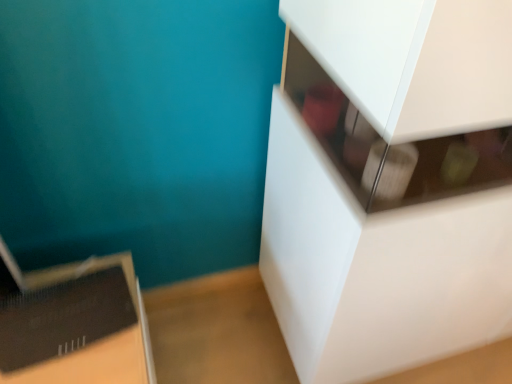
The height and width of the screenshot is (384, 512). Describe the element at coordinates (389, 184) in the screenshot. I see `white glossy cabinet at upper right` at that location.

At what (x,y) coordinates should I click in order to perform the action: click on white glossy cabinet at upper right. Please return your answer as a coordinate pair (x, y). Image resolution: width=512 pixels, height=384 pixels. Looking at the image, I should click on (389, 184).

From the picture: Measure the distance between point [332,85] and camera.

Point [332,85] is 35.00 inches away from camera.

What do you see at coordinates (78, 327) in the screenshot? The image size is (512, 384). I see `black cardboard box at lower left` at bounding box center [78, 327].

Image resolution: width=512 pixels, height=384 pixels. I want to click on black cardboard box at lower left, so click(78, 327).

Find the location of `white glossy cabinet at upper right`. white glossy cabinet at upper right is located at coordinates (389, 184).

Considering the relative positions of white glossy cabinet at upper right and black cardboard box at lower left in the image provided, is white glossy cabinet at upper right to the left of black cardboard box at lower left from the viewer's perspective?

No.

Is white glossy cabinet at upper right behind black cardboard box at lower left?

No, white glossy cabinet at upper right is closer to the camera.

Which point is more distant from viewer, (458, 244) or (1, 330)?

The point (458, 244) is farther from the camera.

From the image's perspective, is white glossy cabinet at upper right on top of black cardboard box at lower left?

Yes, from the image's perspective, white glossy cabinet at upper right is above black cardboard box at lower left.

From a real-world perspective, which object stands above the other?

white glossy cabinet at upper right, from a real-world perspective.

Which of these two, white glossy cabinet at upper right or black cardboard box at lower left, is thinner?

black cardboard box at lower left is thinner.

Is white glossy cabinet at upper right taller or shorter than black cardboard box at lower left?

In the image, white glossy cabinet at upper right appears to be taller than black cardboard box at lower left.

Who is bigger, white glossy cabinet at upper right or black cardboard box at lower left?

white glossy cabinet at upper right is bigger.

Do you think white glossy cabinet at upper right is within black cardboard box at lower left, or outside of it?

white glossy cabinet at upper right is not enclosed by black cardboard box at lower left.

Would you consider white glossy cabinet at upper right to be distant from black cardboard box at lower left?

white glossy cabinet at upper right is actually quite close to black cardboard box at lower left.

Is white glossy cabinet at upper right positioned with its back to black cardboard box at lower left?

white glossy cabinet at upper right is not turned away from black cardboard box at lower left.

How distant is white glossy cabinet at upper right from black cardboard box at lower left?

20.43 inches.

Locate an element on the screen. Image resolution: width=512 pixels, height=384 pixels. furniture above the black cardboard box at lower left (from the image's perspective) is located at coordinates (389, 184).

Does black cardboard box at lower left appear on the right side of white glossy cabinet at upper right?

Incorrect, black cardboard box at lower left is not on the right side of white glossy cabinet at upper right.

Relative to white glossy cabinet at upper right, is black cardboard box at lower left in front or behind?

Visually, black cardboard box at lower left is located behind white glossy cabinet at upper right.

Does point (23, 305) appear closer or farther from the camera than point (467, 45)?

Point (23, 305) is positioned farther from the camera compared to point (467, 45).

From the image's perspective, does black cardboard box at lower left appear higher than white glossy cabinet at upper right?

No, from the image's perspective, black cardboard box at lower left is not on top of white glossy cabinet at upper right.

From a real-world perspective, is black cardboard box at lower left over white glossy cabinet at upper right?

Actually, black cardboard box at lower left is physically below white glossy cabinet at upper right in the real world.

Between black cardboard box at lower left and white glossy cabinet at upper right, which one has larger width?

With larger width is white glossy cabinet at upper right.

Does black cardboard box at lower left have a lesser height compared to white glossy cabinet at upper right?

Yes, black cardboard box at lower left is shorter than white glossy cabinet at upper right.

Considering the sizes of black cardboard box at lower left and white glossy cabinet at upper right in the image, is black cardboard box at lower left bigger or smaller than white glossy cabinet at upper right?

In the image, black cardboard box at lower left appears to be smaller than white glossy cabinet at upper right.

Is black cardboard box at lower left not inside white glossy cabinet at upper right?

black cardboard box at lower left is positioned outside white glossy cabinet at upper right.

Is black cardboard box at lower left touching white glossy cabinet at upper right?

No, black cardboard box at lower left is not with white glossy cabinet at upper right.

Is black cardboard box at lower left facing away from white glossy cabinet at upper right?

No.

In the scene shown: Can you tell me how much black cardboard box at lower left and white glossy cabinet at upper right differ in facing direction?

The facing directions of black cardboard box at lower left and white glossy cabinet at upper right are 12.4 degrees apart.

The height and width of the screenshot is (384, 512). What are the coordinates of `furniture that is on the right side of black cardboard box at lower left` in the screenshot? It's located at (389, 184).

The image size is (512, 384). Find the location of `furniture above the black cardboard box at lower left (from the image's perspective)`. furniture above the black cardboard box at lower left (from the image's perspective) is located at coordinates (389, 184).

Locate an element on the screen. cardboard box behind the white glossy cabinet at upper right is located at coordinates (78, 327).